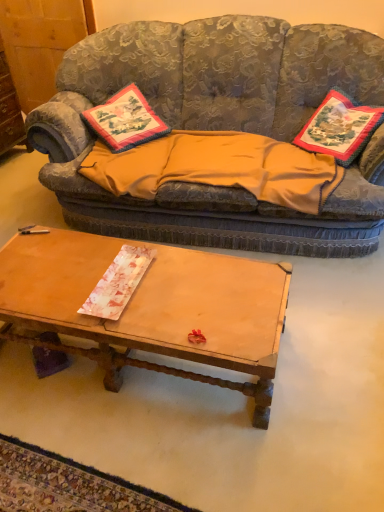
Question: Could you tell me if wooden dresser at left is facing textured fabric couch at upper center?

Choices:
 (A) yes
 (B) no

Answer: (A)

Question: Is wooden dresser at left at the left side of textured fabric couch at upper center?

Choices:
 (A) no
 (B) yes

Answer: (B)

Question: Does wooden dresser at left have a lesser height compared to textured fabric couch at upper center?

Choices:
 (A) no
 (B) yes

Answer: (B)

Question: Considering the relative sizes of wooden dresser at left and textured fabric couch at upper center in the image provided, is wooden dresser at left thinner than textured fabric couch at upper center?

Choices:
 (A) yes
 (B) no

Answer: (A)

Question: From the image's perspective, does wooden dresser at left appear lower than textured fabric couch at upper center?

Choices:
 (A) no
 (B) yes

Answer: (A)

Question: Are wooden dresser at left and textured fabric couch at upper center located far from each other?

Choices:
 (A) yes
 (B) no

Answer: (A)

Question: From a real-world perspective, is embroidered fabric pillow at center, the first pillow in the left-to-right sequence, on top of embroidered fabric pillow at right, marked as the first pillow in a right-to-left arrangement?

Choices:
 (A) yes
 (B) no

Answer: (B)

Question: Considering the relative positions of embroidered fabric pillow at center, placed as the second pillow when sorted from right to left, and embroidered fabric pillow at right, which is the 2th pillow in left-to-right order, in the image provided, is embroidered fabric pillow at center, placed as the second pillow when sorted from right to left, in front of embroidered fabric pillow at right, which is the 2th pillow in left-to-right order,?

Choices:
 (A) no
 (B) yes

Answer: (A)

Question: Could you tell me if embroidered fabric pillow at center, placed as the second pillow when sorted from right to left, is facing embroidered fabric pillow at right, marked as the first pillow in a right-to-left arrangement?

Choices:
 (A) yes
 (B) no

Answer: (B)

Question: Does embroidered fabric pillow at center, the first pillow in the left-to-right sequence, have a larger size compared to embroidered fabric pillow at right, marked as the first pillow in a right-to-left arrangement?

Choices:
 (A) yes
 (B) no

Answer: (B)

Question: Is embroidered fabric pillow at center, placed as the second pillow when sorted from right to left, wider than embroidered fabric pillow at right, which is the 2th pillow in left-to-right order?

Choices:
 (A) yes
 (B) no

Answer: (A)

Question: Considering the relative sizes of embroidered fabric pillow at center, placed as the second pillow when sorted from right to left, and embroidered fabric pillow at right, which is the 2th pillow in left-to-right order, in the image provided, is embroidered fabric pillow at center, placed as the second pillow when sorted from right to left, smaller than embroidered fabric pillow at right, which is the 2th pillow in left-to-right order,?

Choices:
 (A) no
 (B) yes

Answer: (B)

Question: Can you confirm if textured fabric couch at upper center is smaller than orange fabric blanket at center?

Choices:
 (A) no
 (B) yes

Answer: (A)